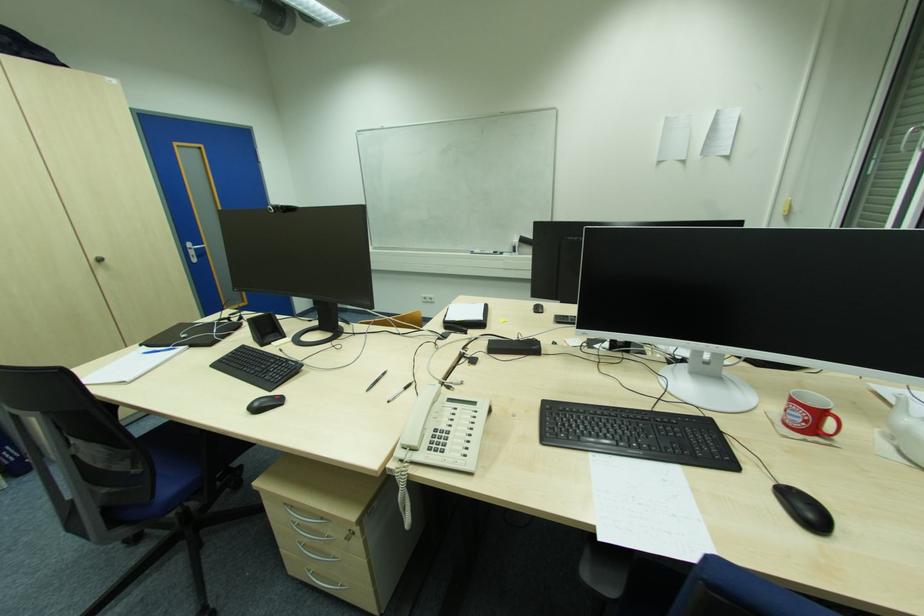
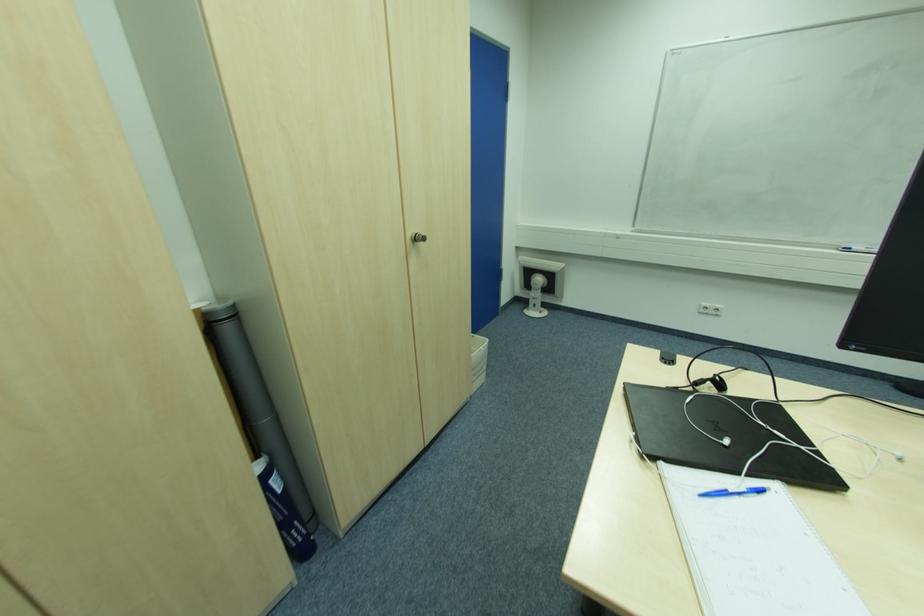
In the second image, find the point that corresponds to [147,347] in the first image.

(663, 464)